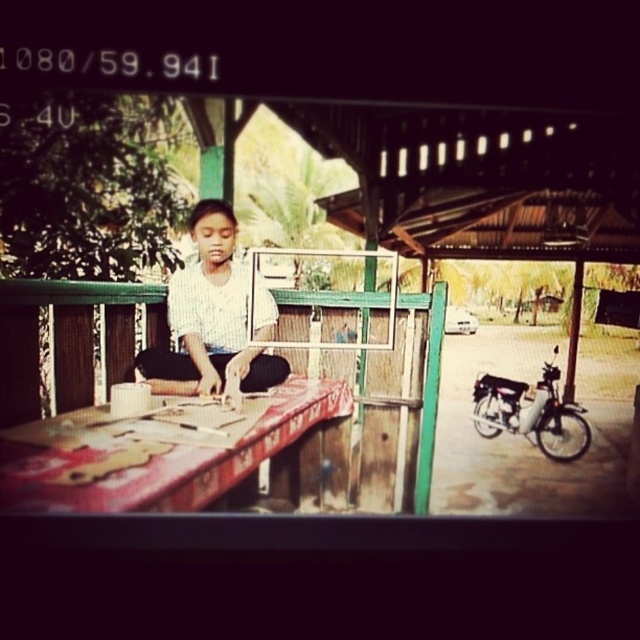
Is wooden table at center to the left of white striped shirt at center from the viewer's perspective?

Correct, you'll find wooden table at center to the left of white striped shirt at center.

Can you confirm if wooden table at center is smaller than white striped shirt at center?

Actually, wooden table at center might be larger than white striped shirt at center.

The height and width of the screenshot is (640, 640). In order to click on wooden table at center in this screenshot , I will do `click(150, 456)`.

Locate an element on the screen. This screenshot has height=640, width=640. wooden table at center is located at coordinates (150, 456).